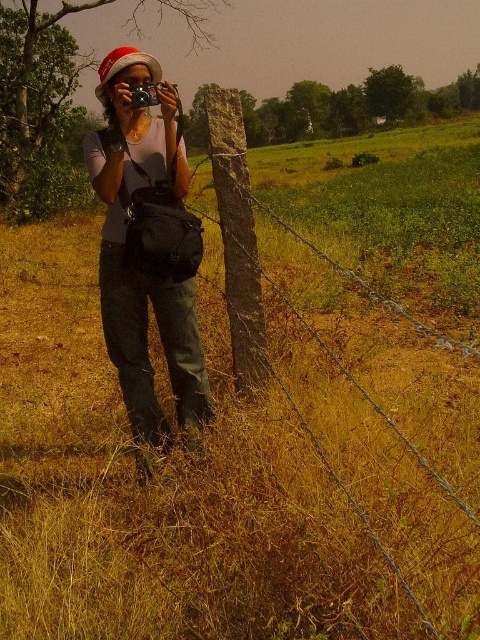
Question: Among these objects, which one is farthest from the camera?

Choices:
 (A) black plastic camera at center
 (B) matte black camera at center
 (C) brown wooden post at center-left

Answer: (A)

Question: Among these objects, which one is nearest to the camera?

Choices:
 (A) matte black camera at center
 (B) black plastic camera at center

Answer: (A)

Question: Is matte black camera at center positioned behind black plastic camera at center?

Choices:
 (A) yes
 (B) no

Answer: (B)

Question: Is brown wooden post at center-left smaller than black plastic camera at center?

Choices:
 (A) yes
 (B) no

Answer: (B)

Question: Is matte black camera at center positioned at the back of brown wooden post at center-left?

Choices:
 (A) no
 (B) yes

Answer: (B)

Question: Estimate the real-world distances between objects in this image. Which object is farther from the matte black camera at center?

Choices:
 (A) black plastic camera at center
 (B) brown wooden post at center-left

Answer: (B)